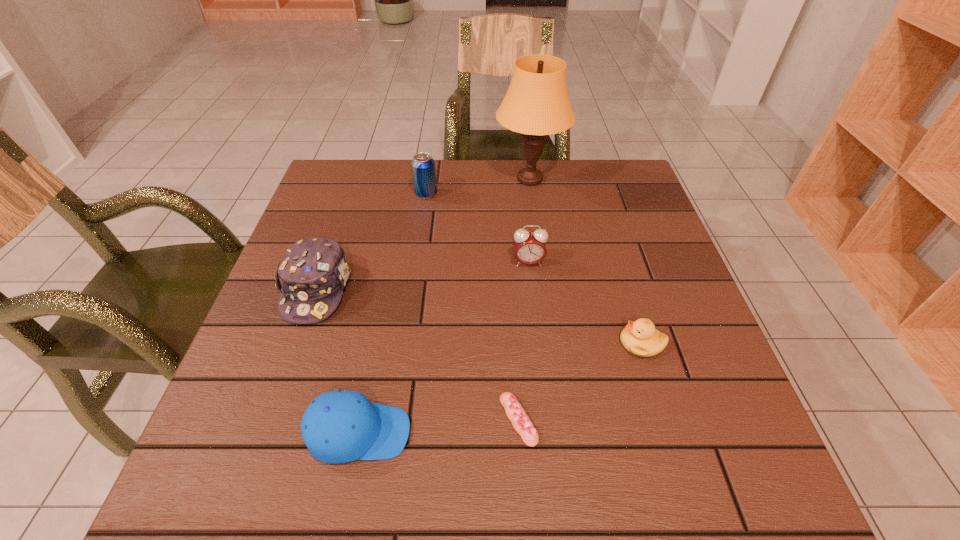
You are a GUI agent. You are given a task and a screenshot of the screen. Output one action in this format:
    pyautogui.click(x=<x>, y=<y>)
    Task: Click on the empty location between the eclair and the lampshade
    This screenshot has width=960, height=540.
    Given the screenshot: What is the action you would take?
    pyautogui.click(x=524, y=299)

Identify the location of object identified as the sixth closest to the rightmost object. (423, 165).

Identify the location of object that is the third closest to the tallest object. The width and height of the screenshot is (960, 540). (313, 272).

Find the location of a particular element. free spot that satisfies the following two spatial constraints: 1. on the front side of the tallest object; 2. on the front-facing side of the nearer cap is located at coordinates (564, 433).

Find the location of a particular element. Image resolution: width=960 pixels, height=540 pixels. free region that satisfies the following two spatial constraints: 1. on the front-facing side of the eclair; 2. on the right side of the farther cap is located at coordinates (272, 420).